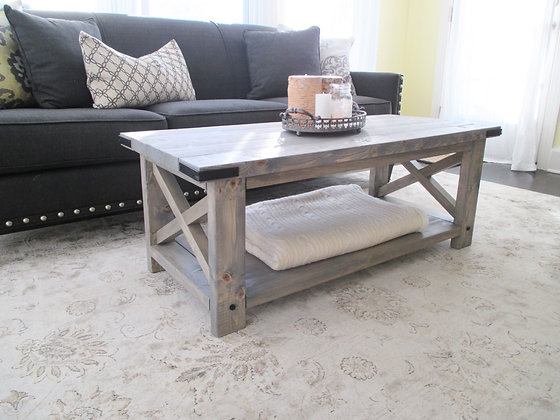
Locate an element on the screen. sofa is located at coordinates point(113,176).